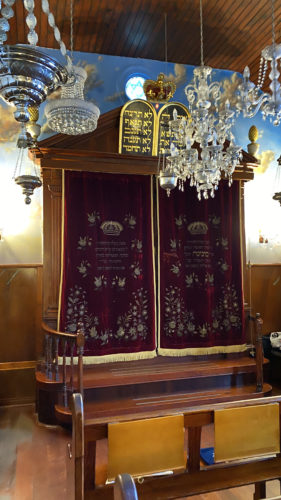
Find the location of `cabnet`. cabnet is located at coordinates (90, 141).